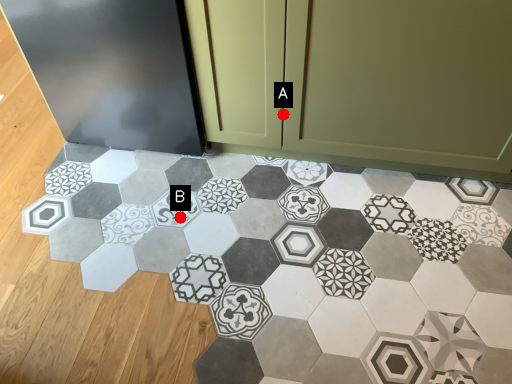
Question: Two points are circled on the image, labeled by A and B beside each circle. Among these points, which one is nearest to the camera?

Choices:
 (A) A is closer
 (B) B is closer

Answer: (A)